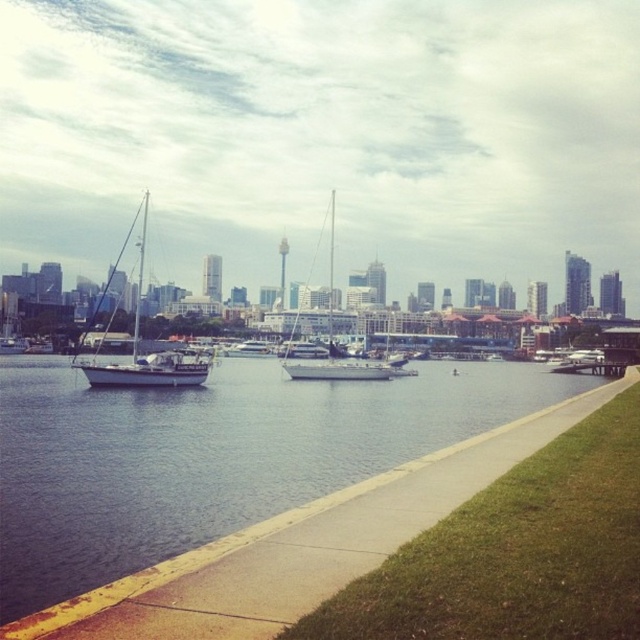
You are standing on the paved pathway and want to walk towards the water. There are two points marked on the path. Which point should you head towards to get closer to the water faster? The points are point (460,472) and point (328,369).

Point (328,369) is further away from the viewer than point (460,472). Therefore, heading towards point (460,472) will get you closer to the water faster since it is nearer to your current position.

You are a photographer planning to take a photo of the white glossy sailboat at left and the white matte sailboat at center from the pathway. Considering their heights, which boat should you position closer to the camera to ensure both appear similar in size in the photo?

The white glossy sailboat at left is taller than the white matte sailboat at center. To make them appear similar in size in the photo, position the shorter white matte sailboat at center closer to the camera while keeping the taller white glossy sailboat at left farther away.

You are a delivery drone that needs to fly over the concrete sidewalk at lower center and the white matte sailboat at center. What object will require you to ascend higher to avoid collision?

The white matte sailboat at center requires ascending higher because it is taller than the concrete sidewalk at lower center.